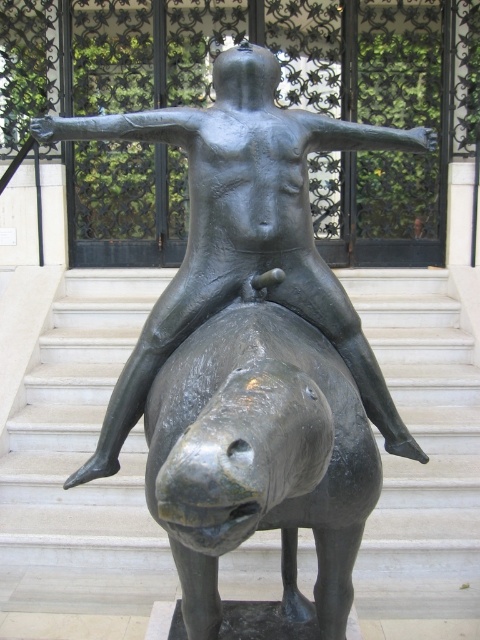
In the scene shown: Which is more to the right, smooth gray horse at center or bronze statue at center?

bronze statue at center is more to the right.

Which of these two, smooth gray horse at center or bronze statue at center, stands taller?

Standing taller between the two is smooth gray horse at center.

Locate an element on the screen. The width and height of the screenshot is (480, 640). smooth gray horse at center is located at coordinates (80, 461).